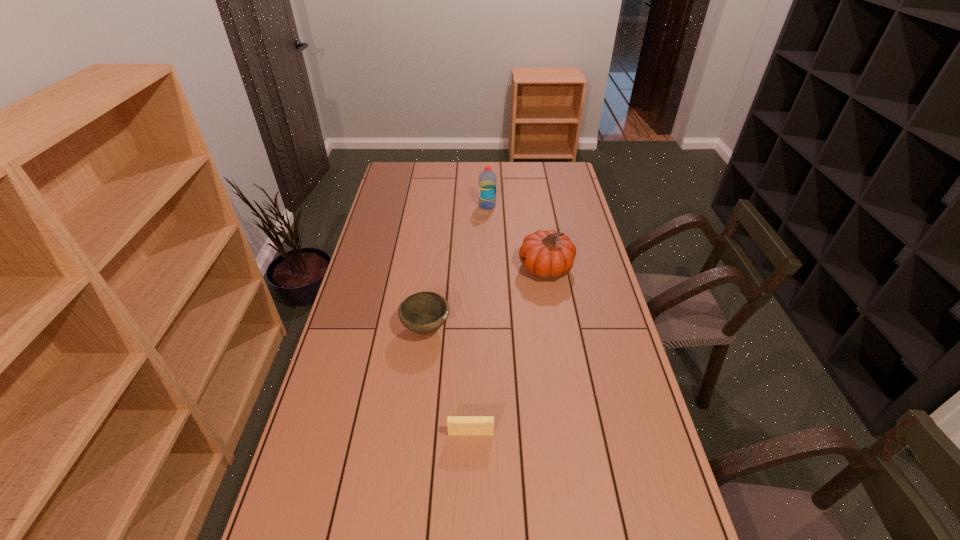
Find the location of `the farthest object`. the farthest object is located at coordinates (487, 179).

At what (x,y) coordinates should I click in order to perform the action: click on the third nearest object. Please return your answer as a coordinate pair (x, y). This screenshot has height=540, width=960. Looking at the image, I should click on (547, 254).

Where is `pumpkin`? Image resolution: width=960 pixels, height=540 pixels. pumpkin is located at coordinates (547, 254).

Image resolution: width=960 pixels, height=540 pixels. I want to click on bowl, so click(424, 312).

This screenshot has width=960, height=540. What are the coordinates of `the second nearest object` in the screenshot? It's located at (424, 312).

This screenshot has width=960, height=540. Identify the location of the shortest object. (457, 425).

Find the location of a particular element. This screenshot has width=960, height=540. videotape is located at coordinates click(x=457, y=425).

Image resolution: width=960 pixels, height=540 pixels. Find the location of `vacant space located on the front label of the water bottle`. vacant space located on the front label of the water bottle is located at coordinates (423, 206).

The width and height of the screenshot is (960, 540). I want to click on free space located on the front label of the water bottle, so click(x=459, y=206).

You are a GUI agent. You are given a task and a screenshot of the screen. Output one action in this format:
    pyautogui.click(x=<x>, y=<y>)
    Task: Click on the blank space located on the front label of the water bottle
    
    Given the screenshot: What is the action you would take?
    pyautogui.click(x=447, y=206)